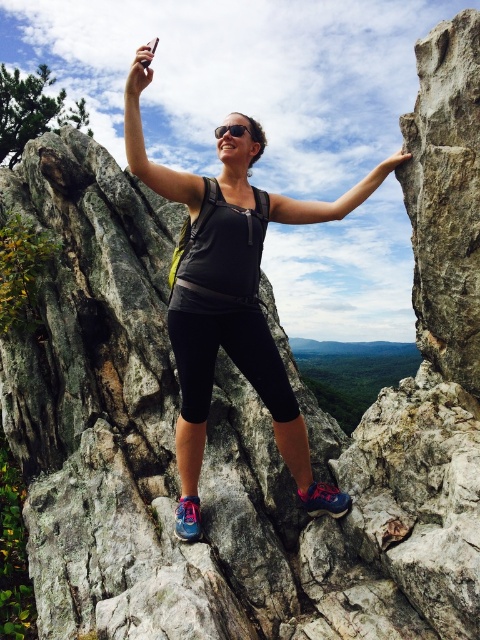
You are a photographer trying to capture the scene of a person on a rocky outcrop. You notice the matte black phone at upper center and the smooth stone hand at upper right in your viewfinder. Which object appears taller in the frame?

The matte black phone at upper center appears taller than the smooth stone hand at upper right in the frame.

You are a photographer trying to capture the perfect shot of the black matte arm at upper center and the smooth stone hand at upper right. Based on their positions, which object should you focus on first to ensure both are in clear view?

The black matte arm at upper center is closer to the viewer than the smooth stone hand at upper right, so you should focus on the black matte arm at upper center first to ensure both are in clear view.